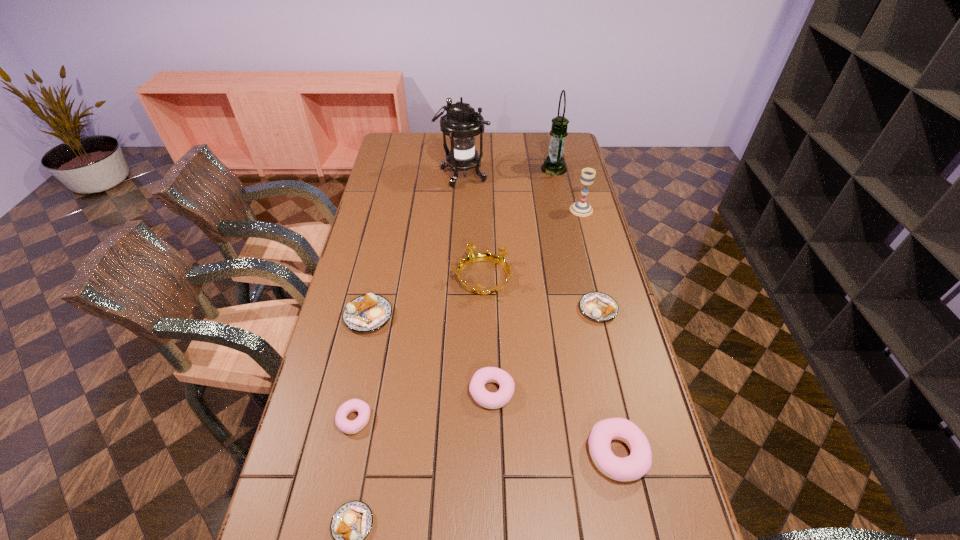
Locate an element on the screen. The width and height of the screenshot is (960, 540). the second smallest brown pastry is located at coordinates coord(598,306).

At what (x,y) coordinates should I click in order to perform the action: click on the leftmost pink pastry. Please return your answer as a coordinate pair (x, y). The width and height of the screenshot is (960, 540). Looking at the image, I should click on (349, 427).

You are a GUI agent. You are given a task and a screenshot of the screen. Output one action in this format:
    pyautogui.click(x=<x>, y=<y>)
    Task: Click on the free space located 0.210m on the back of the black lantern
    
    Given the screenshot: What is the action you would take?
    pyautogui.click(x=465, y=140)

Find the location of a particular element. This screenshot has width=960, height=540. vacant area located 0.290m on the side where the right lantern emits light is located at coordinates (474, 168).

This screenshot has width=960, height=540. I want to click on free space located 0.400m on the side where the right lantern emits light, so click(449, 168).

At what (x,y) coordinates should I click in order to perform the action: click on free space located on the side where the right lantern emits light. Please return your answer as a coordinate pair (x, y). The height and width of the screenshot is (540, 960). Looking at the image, I should click on (529, 168).

This screenshot has height=540, width=960. Find the location of `free space located on the left of the third farthest object`. free space located on the left of the third farthest object is located at coordinates (475, 210).

The height and width of the screenshot is (540, 960). In order to click on vacant space situated 0.090m on the left of the gold crown in this screenshot , I will do `click(426, 278)`.

You are a GUI agent. You are given a task and a screenshot of the screen. Output one action in this format:
    pyautogui.click(x=<x>, y=<y>)
    Task: Click on the free spot located 0.240m on the left of the biggest pink pastry
    
    Given the screenshot: What is the action you would take?
    pyautogui.click(x=488, y=453)

Find the location of a particular element. The width and height of the screenshot is (960, 540). vacant space located 0.060m on the right of the biggest brown pastry is located at coordinates (412, 316).